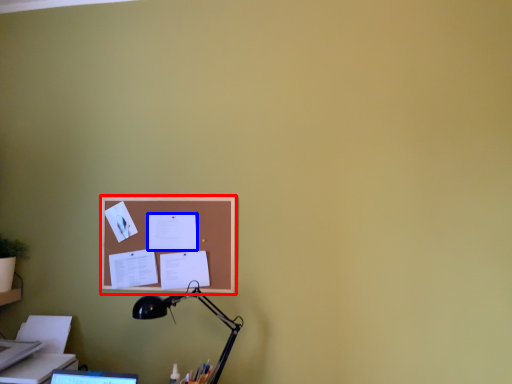
Question: Which object is closer to the camera taking this photo, bulletin board (highlighted by a red box) or paper (highlighted by a blue box)?

Choices:
 (A) bulletin board
 (B) paper

Answer: (A)